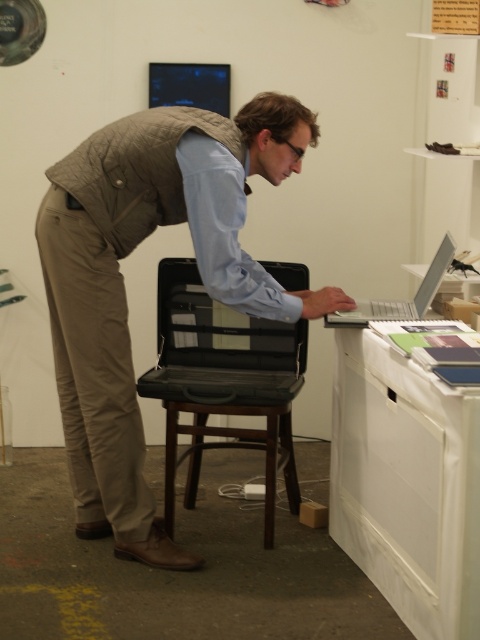
Looking at this image, between light brown quilted vest at center and silver metallic laptop at upper right, which one appears on the left side from the viewer's perspective?

light brown quilted vest at center is more to the left.

Is light brown quilted vest at center to the left of silver metallic laptop at upper right from the viewer's perspective?

Yes, light brown quilted vest at center is to the left of silver metallic laptop at upper right.

Describe the element at coordinates (123, 284) in the screenshot. I see `light brown quilted vest at center` at that location.

The width and height of the screenshot is (480, 640). I want to click on light brown quilted vest at center, so click(123, 284).

Which is below, white glossy table at lower right or black hard plastic chair at center?

white glossy table at lower right

Find the location of `white glossy table at lower right`. white glossy table at lower right is located at coordinates (407, 484).

Is point (277, 394) positioned in front of point (421, 289)?

Yes, point (277, 394) is in front of point (421, 289).

You are a GUI agent. You are given a task and a screenshot of the screen. Output one action in this format:
    pyautogui.click(x=<x>, y=<y>)
    Task: Click on the black hard plastic chair at center
    The height and width of the screenshot is (640, 480).
    Given the screenshot: What is the action you would take?
    pyautogui.click(x=223, y=381)